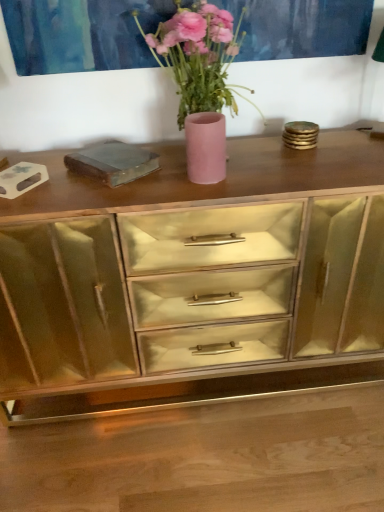
Image resolution: width=384 pixels, height=512 pixels. Find the location of `spots to the right of pink matte vase at center`. spots to the right of pink matte vase at center is located at coordinates (314, 161).